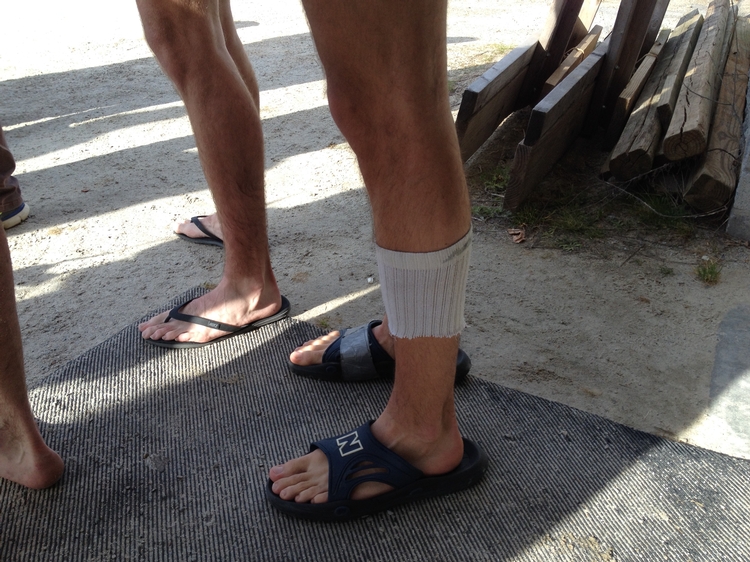
Where is `wood planks`? wood planks is located at coordinates (675, 99), (644, 125), (728, 147), (561, 108), (496, 83), (573, 58), (637, 75), (700, 80).